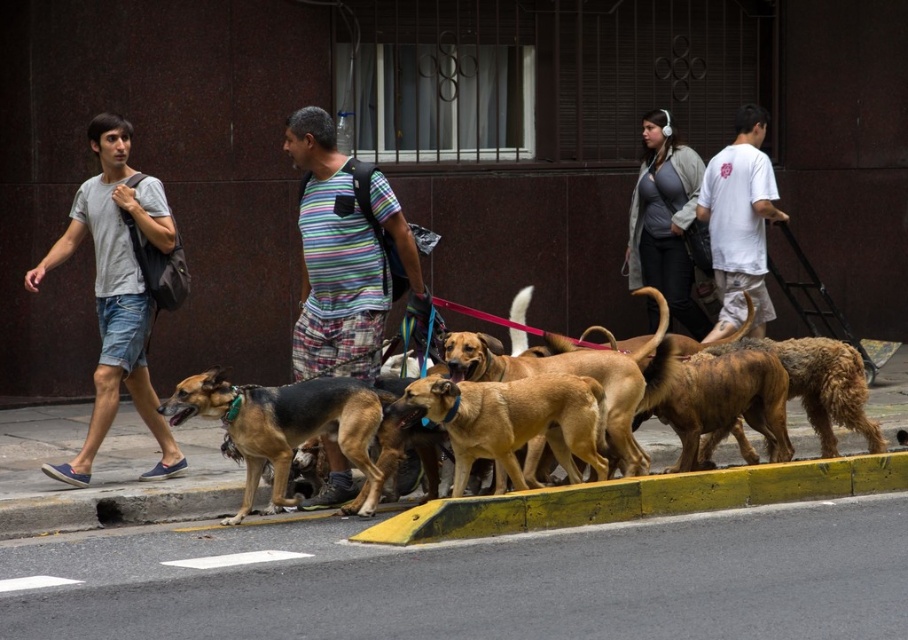
Is white cotton t-shirt at center-right smaller than gray fleece jacket at upper center?

No.

Which is below, white cotton t-shirt at center-right or gray fleece jacket at upper center?

white cotton t-shirt at center-right

Where is `white cotton t-shirt at center-right`? This screenshot has width=908, height=640. white cotton t-shirt at center-right is located at coordinates [x=739, y=221].

The width and height of the screenshot is (908, 640). Identify the location of white cotton t-shirt at center-right. (739, 221).

Does yellow asphalt at lower center have a greater height compared to brown and black fur dog at center?

No, yellow asphalt at lower center is not taller than brown and black fur dog at center.

Describe the element at coordinates (479, 580) in the screenshot. Image resolution: width=908 pixels, height=640 pixels. I see `yellow asphalt at lower center` at that location.

I want to click on yellow asphalt at lower center, so pos(479,580).

Is gray cotton t-shirt at left positioned at the back of brown matte dog at center?

Yes, gray cotton t-shirt at left is further from the viewer.

Identify the location of gray cotton t-shirt at left. (115, 291).